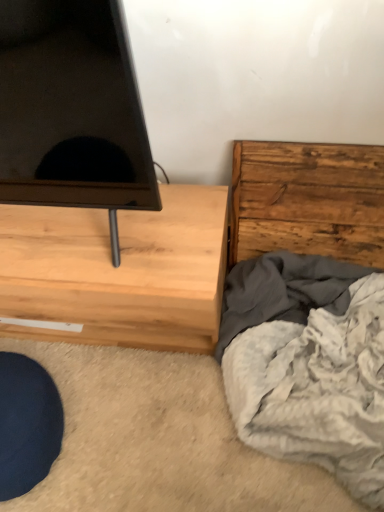
Describe the element at coordinates (118, 271) in the screenshot. I see `light wood chest of drawers at left, marked as the 2th chest of drawers in a right-to-left arrangement` at that location.

Measure the distance between rustic wood chest of drawers at right, which is the 2th chest of drawers in left-to-right order, and camera.

rustic wood chest of drawers at right, which is the 2th chest of drawers in left-to-right order, is 38.61 inches away from camera.

In order to click on light wood chest of drawers at left, acting as the 1th chest of drawers starting from the left in this screenshot , I will do `click(118, 271)`.

From the image's perspective, which object appears higher, soft gray blanket at lower right or rustic wood chest of drawers at right, the 1th chest of drawers viewed from the right?

rustic wood chest of drawers at right, the 1th chest of drawers viewed from the right, from the image's perspective.

Is soft gray blanket at lower right oriented away from rustic wood chest of drawers at right, which is the 2th chest of drawers in left-to-right order?

Yes.

Is soft gray blanket at lower right far from rustic wood chest of drawers at right, the 1th chest of drawers viewed from the right?

No, there isn't a large distance between soft gray blanket at lower right and rustic wood chest of drawers at right, the 1th chest of drawers viewed from the right.

Is point (302, 428) positioned behind point (365, 194)?

That is False.

Considering the positions of objects light wood chest of drawers at left, acting as the 1th chest of drawers starting from the left, and soft gray blanket at lower right in the image provided, who is more to the right, light wood chest of drawers at left, acting as the 1th chest of drawers starting from the left, or soft gray blanket at lower right?

soft gray blanket at lower right is more to the right.

From the image's perspective, would you say light wood chest of drawers at left, marked as the 2th chest of drawers in a right-to-left arrangement, is shown under soft gray blanket at lower right?

Actually, light wood chest of drawers at left, marked as the 2th chest of drawers in a right-to-left arrangement, appears above soft gray blanket at lower right in the image.

In order to click on chest of drawers on the left of soft gray blanket at lower right in this screenshot , I will do `click(118, 271)`.

Is light wood chest of drawers at left, acting as the 1th chest of drawers starting from the left, oriented towards soft gray blanket at lower right?

No, light wood chest of drawers at left, acting as the 1th chest of drawers starting from the left, is not turned towards soft gray blanket at lower right.

Does point (188, 342) come behind point (277, 249)?

No, (188, 342) is in front of (277, 249).

How many degrees apart are the facing directions of light wood chest of drawers at left, acting as the 1th chest of drawers starting from the left, and rustic wood chest of drawers at right, which is the 2th chest of drawers in left-to-right order?

The angle between the facing direction of light wood chest of drawers at left, acting as the 1th chest of drawers starting from the left, and the facing direction of rustic wood chest of drawers at right, which is the 2th chest of drawers in left-to-right order, is 0.916 degrees.

From a real-world perspective, is light wood chest of drawers at left, marked as the 2th chest of drawers in a right-to-left arrangement, physically above rustic wood chest of drawers at right, the 1th chest of drawers viewed from the right?

No, from a real-world perspective, light wood chest of drawers at left, marked as the 2th chest of drawers in a right-to-left arrangement, is not above rustic wood chest of drawers at right, the 1th chest of drawers viewed from the right.

The height and width of the screenshot is (512, 384). I want to click on chest of drawers on the right side of light wood chest of drawers at left, acting as the 1th chest of drawers starting from the left, so click(x=308, y=200).

From a real-world perspective, starting from the soft gray blanket at lower right, which chest of drawers is the 1st one vertically above it? Please provide its 2D coordinates.

[(118, 271)]

In the scene shown: From the image's perspective, between soft gray blanket at lower right and light wood chest of drawers at left, acting as the 1th chest of drawers starting from the left, who is located below?

soft gray blanket at lower right.

Is light wood chest of drawers at left, marked as the 2th chest of drawers in a right-to-left arrangement, surrounded by soft gray blanket at lower right?

That's incorrect, light wood chest of drawers at left, marked as the 2th chest of drawers in a right-to-left arrangement, is not inside soft gray blanket at lower right.

Is soft gray blanket at lower right next to light wood chest of drawers at left, acting as the 1th chest of drawers starting from the left?

soft gray blanket at lower right is not next to light wood chest of drawers at left, acting as the 1th chest of drawers starting from the left, and they're not touching.

Is the surface of rustic wood chest of drawers at right, the 1th chest of drawers viewed from the right, in direct contact with light wood chest of drawers at left, marked as the 2th chest of drawers in a right-to-left arrangement?

No, rustic wood chest of drawers at right, the 1th chest of drawers viewed from the right, is not next to light wood chest of drawers at left, marked as the 2th chest of drawers in a right-to-left arrangement.

From a real-world perspective, who is located higher, rustic wood chest of drawers at right, the 1th chest of drawers viewed from the right, or light wood chest of drawers at left, acting as the 1th chest of drawers starting from the left?

In real-world perspective, rustic wood chest of drawers at right, the 1th chest of drawers viewed from the right, is above.

Is point (304, 253) positioned before point (223, 193)?

No, it is behind (223, 193).

Based on the photo, from the image's perspective, is rustic wood chest of drawers at right, which is the 2th chest of drawers in left-to-right order, on light wood chest of drawers at left, acting as the 1th chest of drawers starting from the left?

Yes.

Is rustic wood chest of drawers at right, the 1th chest of drawers viewed from the right, not close to soft gray blanket at lower right?

That's not correct — rustic wood chest of drawers at right, the 1th chest of drawers viewed from the right, is a little close to soft gray blanket at lower right.

Which of these two, rustic wood chest of drawers at right, which is the 2th chest of drawers in left-to-right order, or soft gray blanket at lower right, is smaller?

rustic wood chest of drawers at right, which is the 2th chest of drawers in left-to-right order, is smaller.

Between point (361, 193) and point (274, 383), which one is positioned behind?

The point (361, 193) is behind.

Is rustic wood chest of drawers at right, the 1th chest of drawers viewed from the right, taller or shorter than soft gray blanket at lower right?

rustic wood chest of drawers at right, the 1th chest of drawers viewed from the right, is taller than soft gray blanket at lower right.

The height and width of the screenshot is (512, 384). Find the location of `chest of drawers lying on the right of soft gray blanket at lower right`. chest of drawers lying on the right of soft gray blanket at lower right is located at coordinates tap(308, 200).

From a real-world perspective, which chest of drawers is the 1st one above the soft gray blanket at lower right? Please provide its 2D coordinates.

[(118, 271)]

Based on their spatial positions, is rustic wood chest of drawers at right, the 1th chest of drawers viewed from the right, or light wood chest of drawers at left, marked as the 2th chest of drawers in a right-to-left arrangement, closer to soft gray blanket at lower right?

Based on the image, rustic wood chest of drawers at right, the 1th chest of drawers viewed from the right, appears to be nearer to soft gray blanket at lower right.

Which object lies nearer to the anchor point rustic wood chest of drawers at right, which is the 2th chest of drawers in left-to-right order, soft gray blanket at lower right or light wood chest of drawers at left, acting as the 1th chest of drawers starting from the left?

Among the two, soft gray blanket at lower right is located nearer to rustic wood chest of drawers at right, which is the 2th chest of drawers in left-to-right order.

Looking at the image, which one is located further to light wood chest of drawers at left, marked as the 2th chest of drawers in a right-to-left arrangement, soft gray blanket at lower right or rustic wood chest of drawers at right, the 1th chest of drawers viewed from the right?

Based on the image, rustic wood chest of drawers at right, the 1th chest of drawers viewed from the right, appears to be further to light wood chest of drawers at left, marked as the 2th chest of drawers in a right-to-left arrangement.

Based on the photo, which object lies nearer to the anchor point soft gray blanket at lower right, light wood chest of drawers at left, marked as the 2th chest of drawers in a right-to-left arrangement, or rustic wood chest of drawers at right, the 1th chest of drawers viewed from the right?

rustic wood chest of drawers at right, the 1th chest of drawers viewed from the right, is closer to soft gray blanket at lower right.

Considering their positions, is light wood chest of drawers at left, acting as the 1th chest of drawers starting from the left, positioned further to rustic wood chest of drawers at right, the 1th chest of drawers viewed from the right, than soft gray blanket at lower right?

light wood chest of drawers at left, acting as the 1th chest of drawers starting from the left, is further to rustic wood chest of drawers at right, the 1th chest of drawers viewed from the right.

From the image, which object appears to be farther from light wood chest of drawers at left, acting as the 1th chest of drawers starting from the left, rustic wood chest of drawers at right, the 1th chest of drawers viewed from the right, or soft gray blanket at lower right?

rustic wood chest of drawers at right, the 1th chest of drawers viewed from the right.

Where is `blanket between light wood chest of drawers at left, marked as the 2th chest of drawers in a right-to-left arrangement, and rustic wood chest of drawers at right, which is the 2th chest of drawers in left-to-right order`? The width and height of the screenshot is (384, 512). blanket between light wood chest of drawers at left, marked as the 2th chest of drawers in a right-to-left arrangement, and rustic wood chest of drawers at right, which is the 2th chest of drawers in left-to-right order is located at coordinates (308, 364).